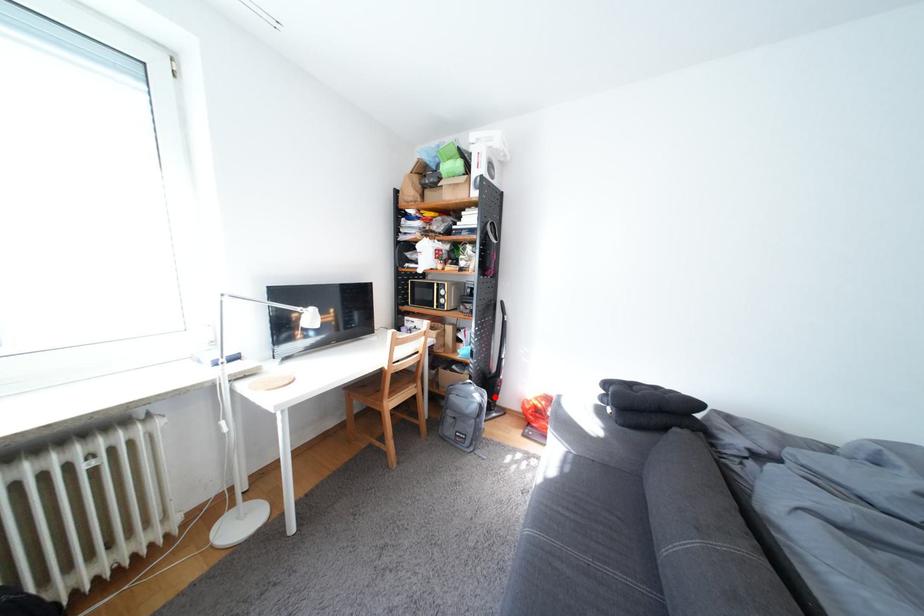
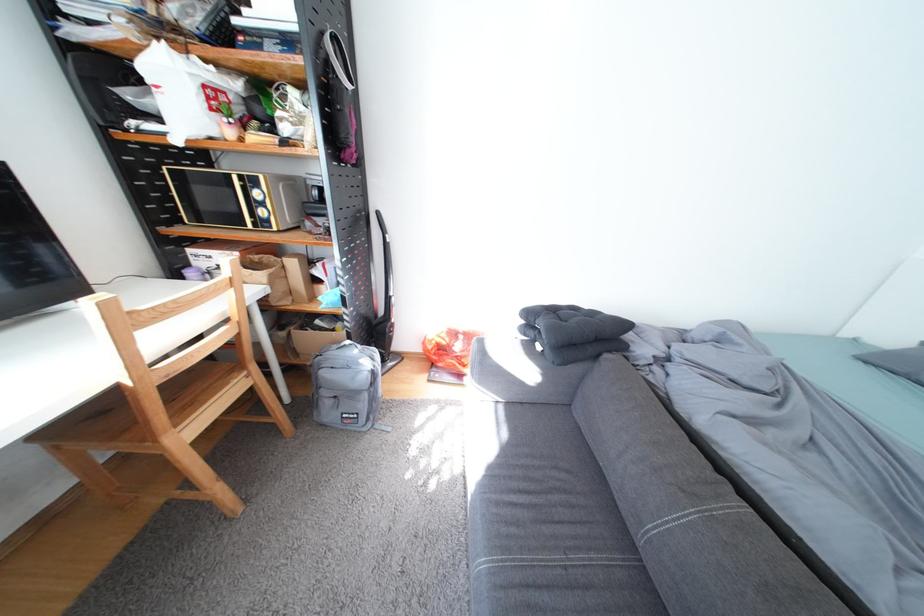
Question: I am providing you with two images of the same scene from different viewpoints. Given a red point in image1, look at the same physical point in image2. Is it:

Choices:
 (A) Closer to the viewpoint
 (B) Farther from the viewpoint

Answer: (A)